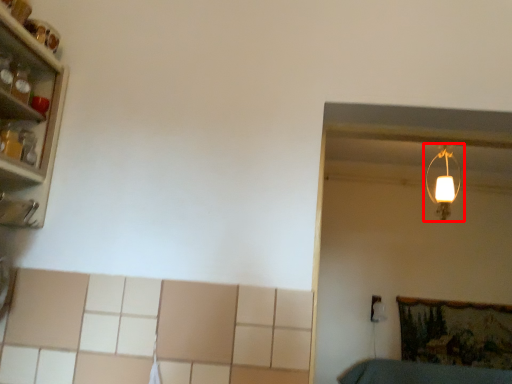
Question: Considering the relative positions of lamp (annotated by the red box) and shelf in the image provided, where is lamp (annotated by the red box) located with respect to the staircase?

Choices:
 (A) left
 (B) right

Answer: (B)